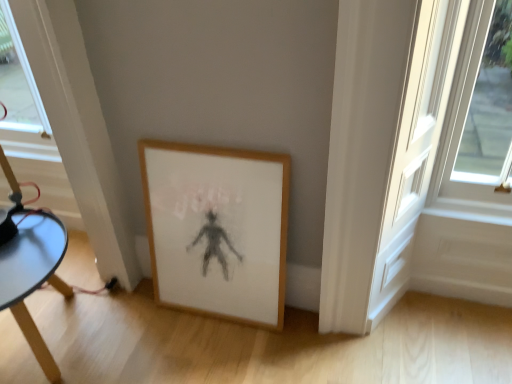
Image resolution: width=512 pixels, height=384 pixels. What are the coordinates of `vacant region below wooden table at lower left (from a real-world perspective)` in the screenshot? It's located at (51, 342).